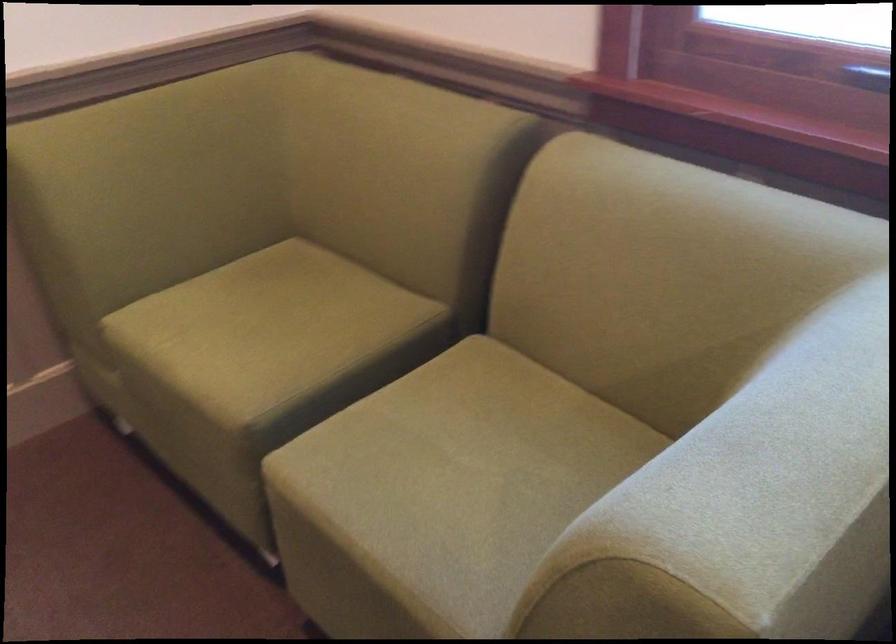
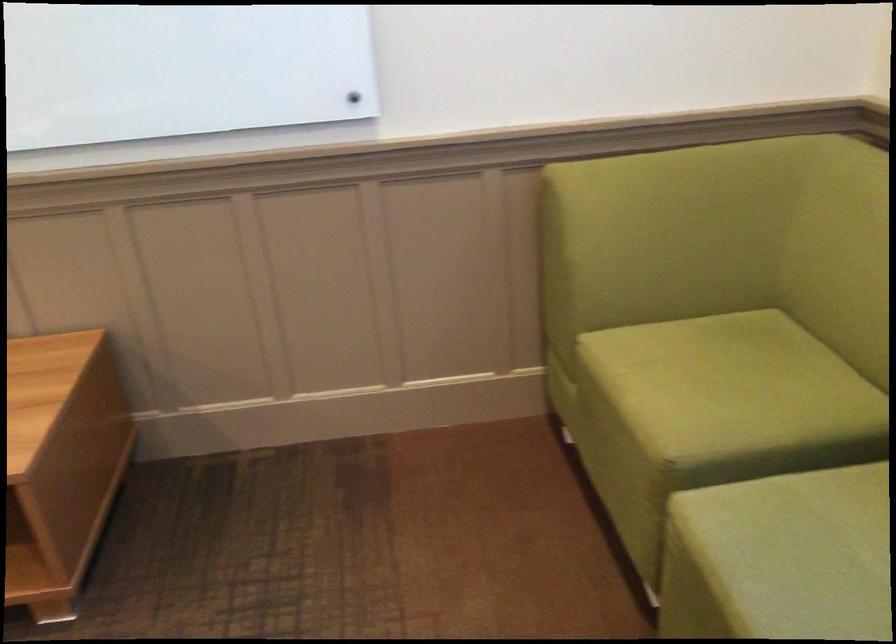
Question: Based on the continuous images, in which direction is the camera rotating? Reply with the corresponding letter.

Choices:
 (A) Left
 (B) Right
 (C) Up
 (D) Down

Answer: (A)